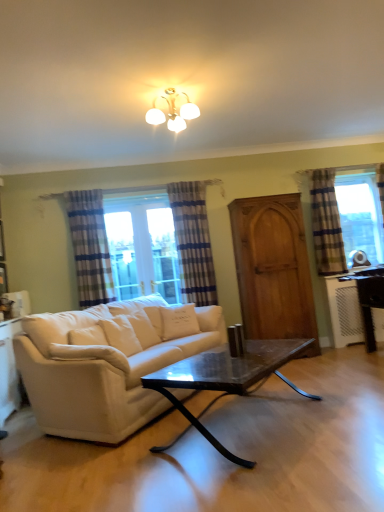
Identify the location of blank space above striped fabric curtain at left, the 1th curtain positioned from the left (from a real-world perspective). (82, 191).